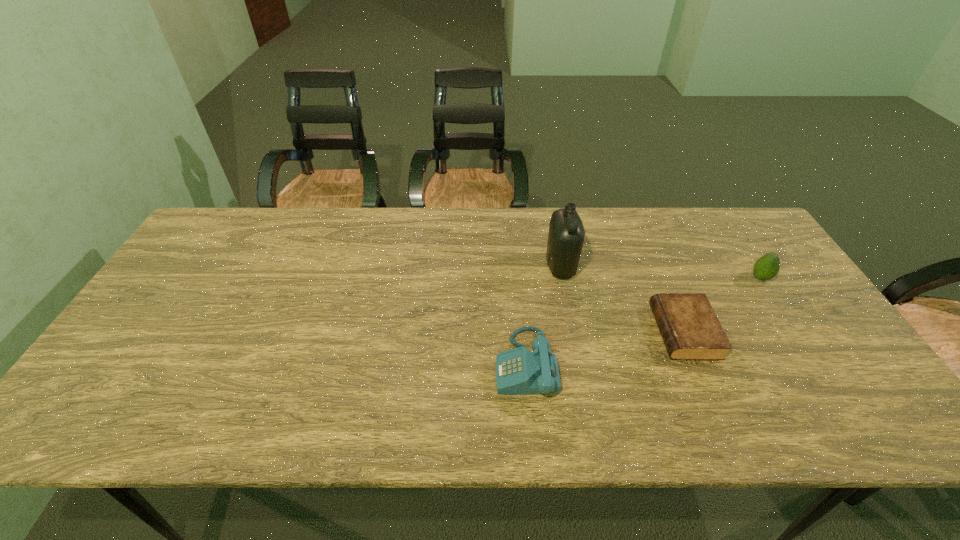
At what (x,y) coordinates should I click in order to perform the action: click on the second object from left to right. Please return your answer as a coordinate pair (x, y). The height and width of the screenshot is (540, 960). Looking at the image, I should click on (566, 235).

This screenshot has width=960, height=540. What are the coordinates of `bottle` in the screenshot? It's located at (566, 235).

The image size is (960, 540). In order to click on avocado in this screenshot , I will do `click(767, 267)`.

You are a GUI agent. You are given a task and a screenshot of the screen. Output one action in this format:
    pyautogui.click(x=<x>, y=<y>)
    Task: Click on the leftmost object
    The image size is (960, 540).
    Given the screenshot: What is the action you would take?
    pyautogui.click(x=518, y=371)

Identify the location of diary. (690, 329).

Find the location of `the shortest object`. the shortest object is located at coordinates (690, 329).

You are a GUI agent. You are given a task and a screenshot of the screen. Output one action in this format:
    pyautogui.click(x=<x>, y=<y>)
    Task: Click on the free space located 0.150m on the right of the tallest object
    The width and height of the screenshot is (960, 540).
    Given the screenshot: What is the action you would take?
    pyautogui.click(x=626, y=267)

In order to click on free space located 0.230m on the back of the rightmost object in this screenshot , I will do `click(725, 224)`.

You are a GUI agent. You are given a task and a screenshot of the screen. Output one action in this format:
    pyautogui.click(x=<x>, y=<y>)
    Task: Click on the blank space located 0.370m on the dial of the telephone
    
    Given the screenshot: What is the action you would take?
    pyautogui.click(x=343, y=364)

Find the location of a particular element. The image size is (960, 540). free location located on the dial of the telephone is located at coordinates (445, 364).